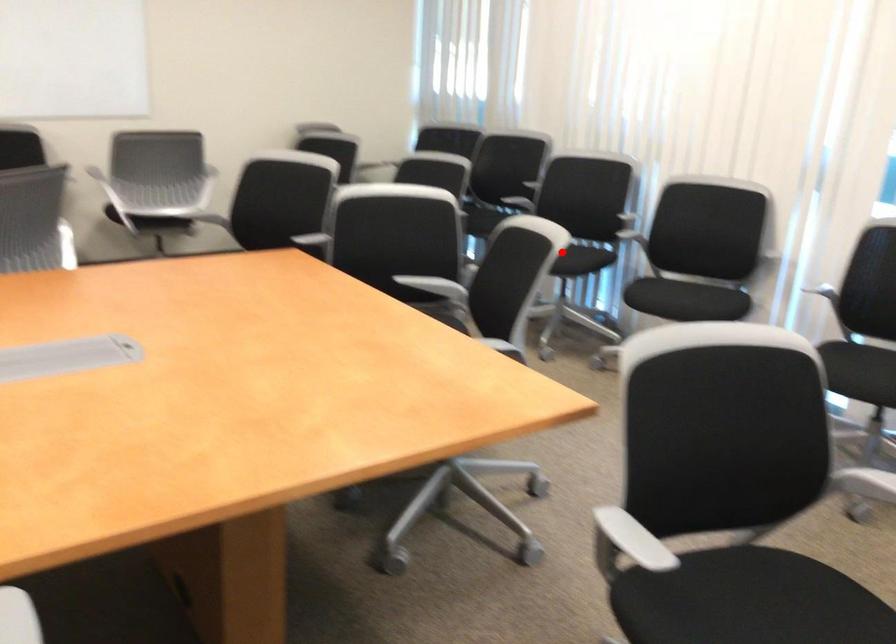
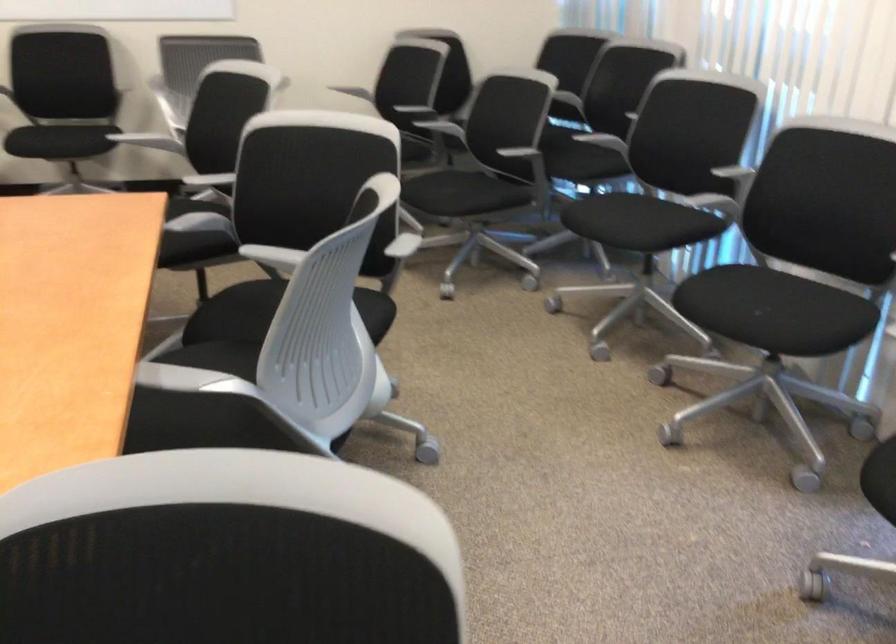
Question: I am providing you with two images of the same scene from different viewpoints. Image1 has a red point marked. In image2, the corresponding 3D location appears at what relative position? Reply with the corresponding letter.

Choices:
 (A) Closer
 (B) Farther

Answer: (A)